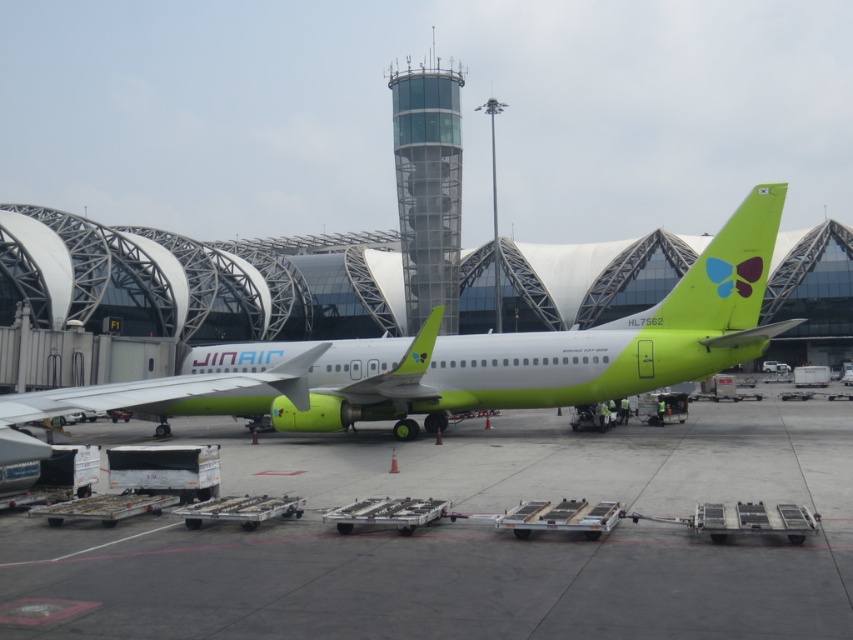
Does green matte tarmac at center come in front of matte green airplane at center?

No, green matte tarmac at center is behind matte green airplane at center.

Which of these two, green matte tarmac at center or matte green airplane at center, stands shorter?

green matte tarmac at center

Describe the element at coordinates (471, 540) in the screenshot. I see `green matte tarmac at center` at that location.

Find the location of a particular element. This screenshot has width=853, height=640. green matte tarmac at center is located at coordinates (471, 540).